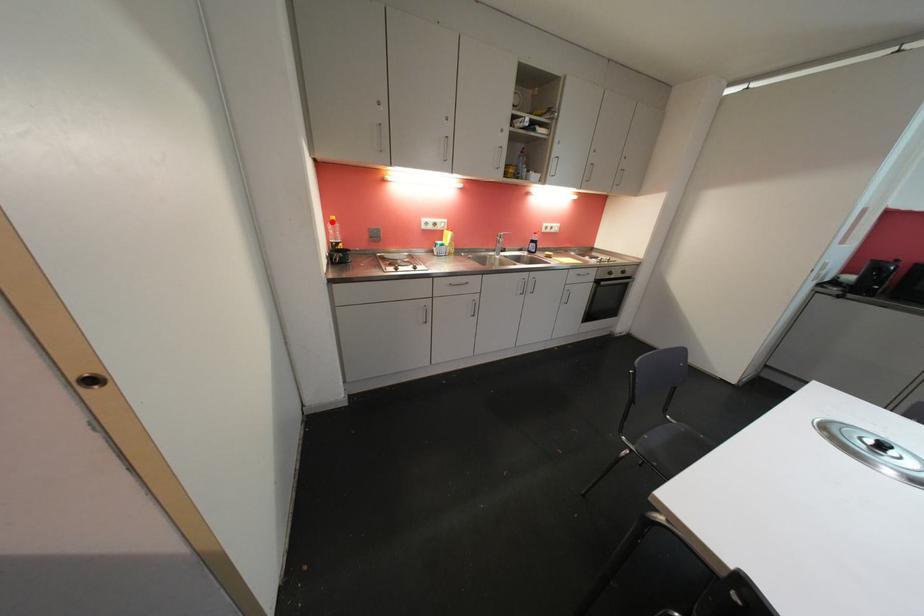
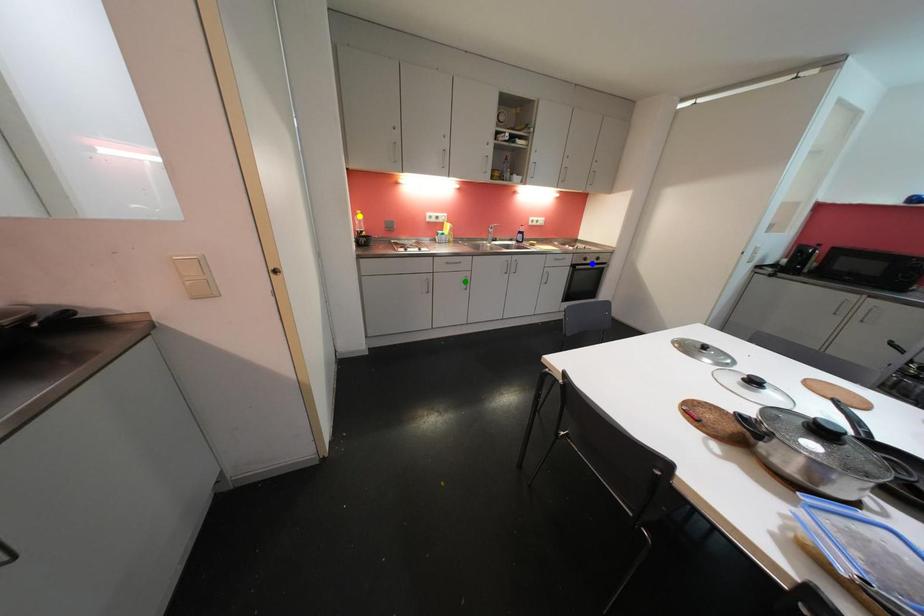
Question: I am providing you with two images of the same scene from different viewpoints. A red point is marked on the first image. You are given multiple points on the second image. In image 2, which mark is for the same physical point as the one in image 1?

Choices:
 (A) blue point
 (B) green point
 (C) yellow point

Answer: (C)